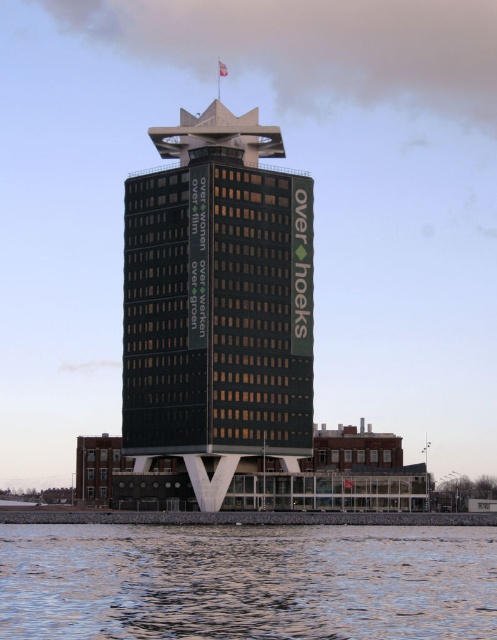
You are an architect evaluating the proportions of the green glass building at center and the clear water at lower left in the image. Which one has a greater width?

The clear water at lower left has a greater width than the green glass building at center.